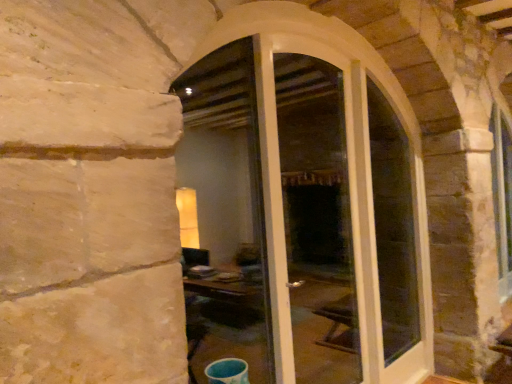
Describe the element at coordinates (393, 226) in the screenshot. I see `clear glass door at center` at that location.

I want to click on clear glass door at center, so click(x=393, y=226).

This screenshot has height=384, width=512. What are the coordinates of `clear glass door at center` in the screenshot? It's located at (393, 226).

Is white glass door at center not near clear glass door at center?

Actually, white glass door at center and clear glass door at center are a little close together.

Considering their positions, is white glass door at center located in front of or behind clear glass door at center?

Visually, white glass door at center is located in front of clear glass door at center.

Considering the positions of point (320, 276) and point (385, 238), is point (320, 276) closer or farther from the camera than point (385, 238)?

Point (320, 276) is farther from the camera than point (385, 238).

Can you confirm if white glass door at center is positioned to the right of clear glass door at center?

In fact, white glass door at center is to the left of clear glass door at center.

From a real-world perspective, relative to white glossy screen door at center, is white glass door at center vertically above or below?

From a real-world perspective, white glass door at center is physically below white glossy screen door at center.

Is white glass door at center completely or partially outside of white glossy screen door at center?

No, white glass door at center is inside or overlapping with white glossy screen door at center.

Does white glass door at center have a smaller size compared to white glossy screen door at center?

Actually, white glass door at center might be larger than white glossy screen door at center.

Does white glossy screen door at center turn towards clear glass door at center?

No, white glossy screen door at center is not turned towards clear glass door at center.

Is white glossy screen door at center inside or outside of clear glass door at center?

white glossy screen door at center is spatially situated outside clear glass door at center.

Locate an element on the screen. Image resolution: width=512 pixels, height=384 pixels. glass window behind the white glossy screen door at center is located at coordinates (393, 226).

In the scene shown: Considering the sizes of objects clear glass door at center and white glass door at center in the image provided, who is taller, clear glass door at center or white glass door at center?

white glass door at center is taller.

Which of these two, clear glass door at center or white glass door at center, is wider?

white glass door at center is wider.

From a real-world perspective, is clear glass door at center physically above white glass door at center?

Yes, from a real-world perspective, clear glass door at center is over white glass door at center

Which object is closer to the camera, white glossy screen door at center or white glass door at center?

white glass door at center is closer to the camera.

Can we say white glossy screen door at center lies outside white glass door at center?

No, most part of white glossy screen door at center lies within white glass door at center.

Looking at the image, does white glossy screen door at center seem bigger or smaller compared to white glass door at center?

Considering their sizes, white glossy screen door at center takes up less space than white glass door at center.

From a real-world perspective, is clear glass door at center physically below white glossy screen door at center?

Yes, from a real-world perspective, clear glass door at center is below white glossy screen door at center.

Between clear glass door at center and white glossy screen door at center, which one is positioned behind?

clear glass door at center is further away from the camera.

Looking at this image, does clear glass door at center have a smaller size compared to white glossy screen door at center?

Indeed, clear glass door at center has a smaller size compared to white glossy screen door at center.

Is clear glass door at center facing towards white glossy screen door at center?

No, clear glass door at center is not aimed at white glossy screen door at center.

The width and height of the screenshot is (512, 384). What are the coordinates of `glass window above the white glass door at center (from the image's perspective)` in the screenshot? It's located at (393, 226).

You are a GUI agent. You are given a task and a screenshot of the screen. Output one action in this format:
    pyautogui.click(x=<x>, y=<y>)
    Task: Click on the door in front of the white glossy screen door at center
    The width and height of the screenshot is (512, 384).
    Given the screenshot: What is the action you would take?
    pyautogui.click(x=303, y=218)

Based on the photo, looking at the image, which one is located further to white glass door at center, clear glass door at center or white glossy screen door at center?

white glossy screen door at center lies further to white glass door at center than the other object.

Looking at the image, which one is located closer to clear glass door at center, white glossy screen door at center or white glass door at center?

Among the two, white glass door at center is located nearer to clear glass door at center.

Considering their positions, is white glossy screen door at center positioned further to white glass door at center than clear glass door at center?

Based on the image, white glossy screen door at center appears to be further to white glass door at center.

Which object lies nearer to the anchor point white glossy screen door at center, white glass door at center or clear glass door at center?

clear glass door at center.

Looking at the image, which one is located further to white glossy screen door at center, clear glass door at center or white glass door at center?

Based on the image, white glass door at center appears to be further to white glossy screen door at center.

When comparing their distances from clear glass door at center, does white glass door at center or white glossy screen door at center seem further?

white glossy screen door at center is positioned further to the anchor clear glass door at center.

Locate an element on the screen. The height and width of the screenshot is (384, 512). screen door between white glass door at center and clear glass door at center along the z-axis is located at coordinates (308, 221).